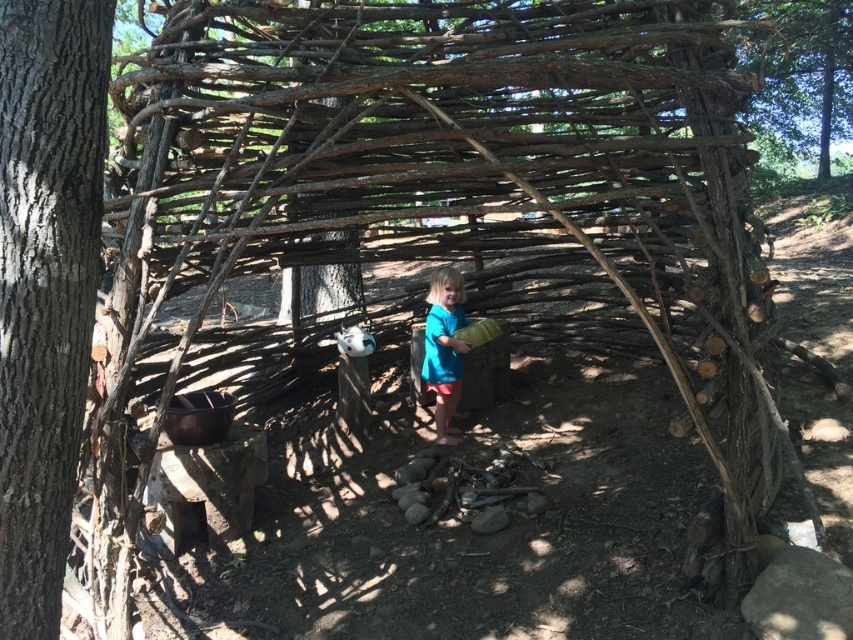
Based on the scene, which object takes up more space in the image between the brown rough bark tree at left and the green leafy tree at upper right?

The green leafy tree at upper right occupies more space than the brown rough bark tree at left according to the description.

You are a bird flying over the rustic setting. You see the green leafy tree at upper right and the blue fabric at center. Which object is closer to you?

The green leafy tree at upper right is closer to you because it is further to the viewer than the blue fabric at center.

Consider the image. You are standing at the center of the structure and want to find the brown rough bark tree at left. In which direction should you look to see it?

The brown rough bark tree at left is located at point 0.447 on the x axis and 0.054 on the y axis. Since you are at the center, you should look towards the left side of the structure to find it.